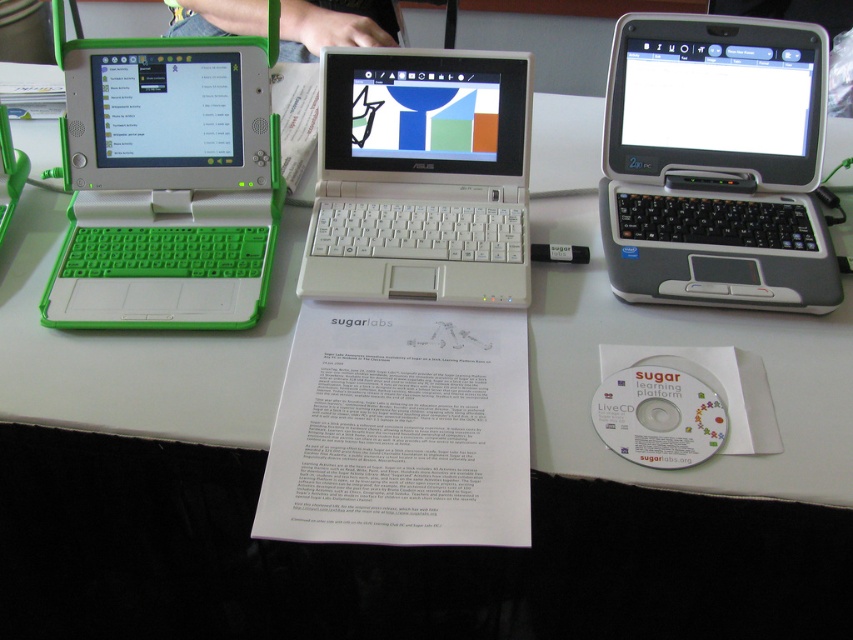
You are a delivery person who needs to place a rectangular box that is 8 inches long between the green matte laptop at left and the white plastic laptop at center on the table. Can you fit the box between them without moving either laptop?

The distance between the green matte laptop at left and the white plastic laptop at center is 7.92 inches. Since the box is 8 inches long, it cannot fit between them as the space is slightly smaller than the box.